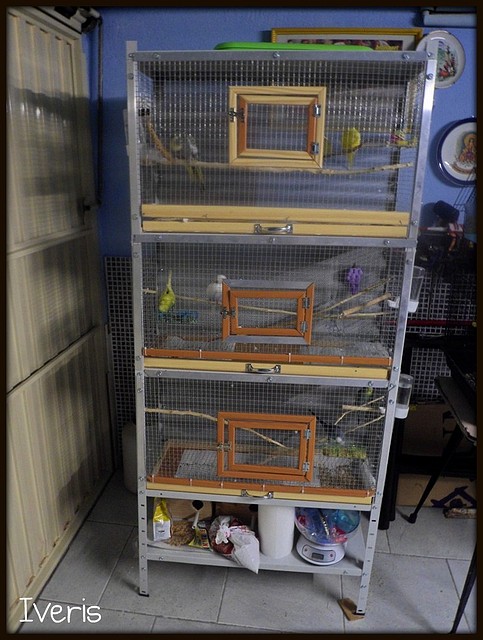
At what (x,y) coordinates should I click in order to perform the action: click on paper towles. Please return your answer as a coordinate pair (x, y). Image resolution: width=483 pixels, height=640 pixels. Looking at the image, I should click on (273, 540).